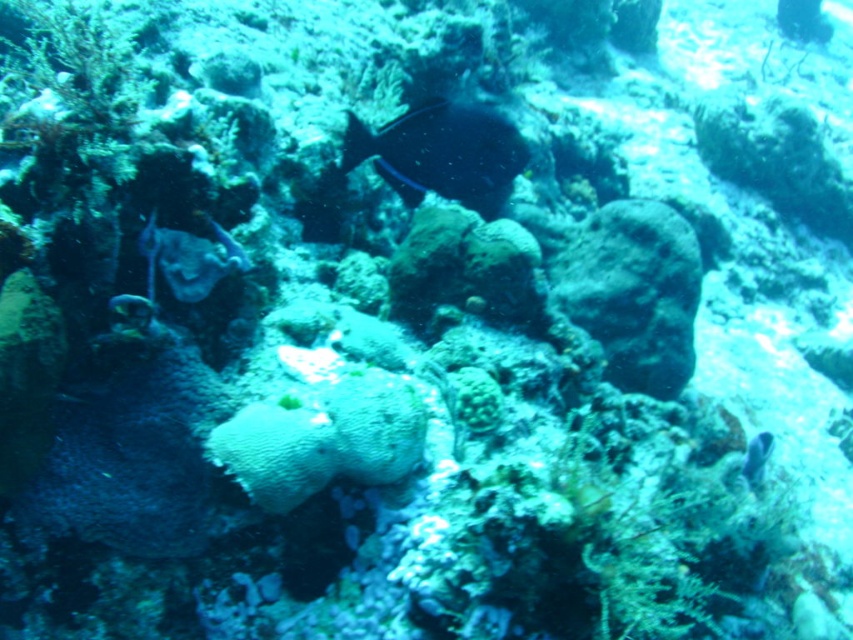
Does point (409, 122) come behind point (755, 440)?

No, (409, 122) is in front of (755, 440).

Is point (427, 177) closer to camera compared to point (769, 432)?

Yes, point (427, 177) is closer to viewer.

This screenshot has height=640, width=853. In order to click on shiny black fish at center in this screenshot , I will do `click(440, 154)`.